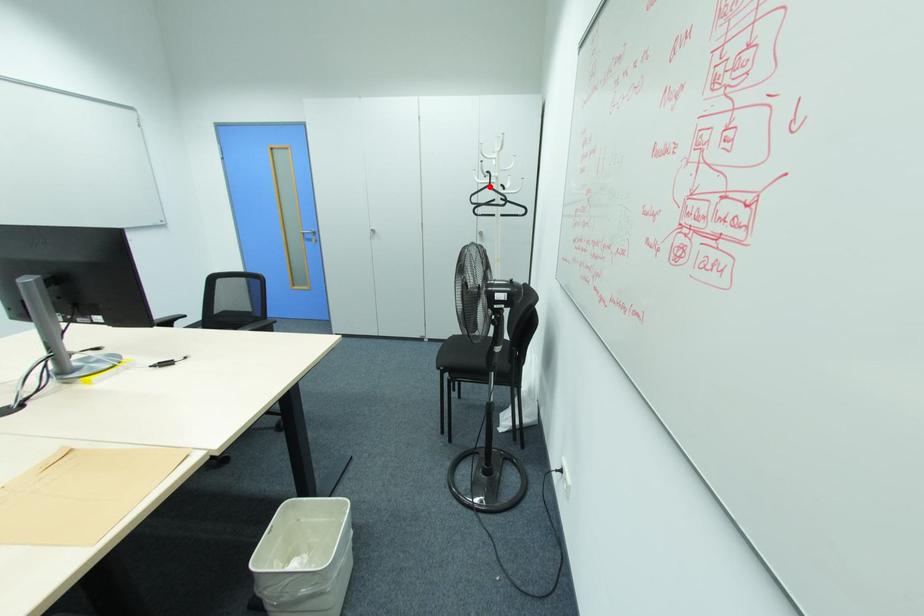
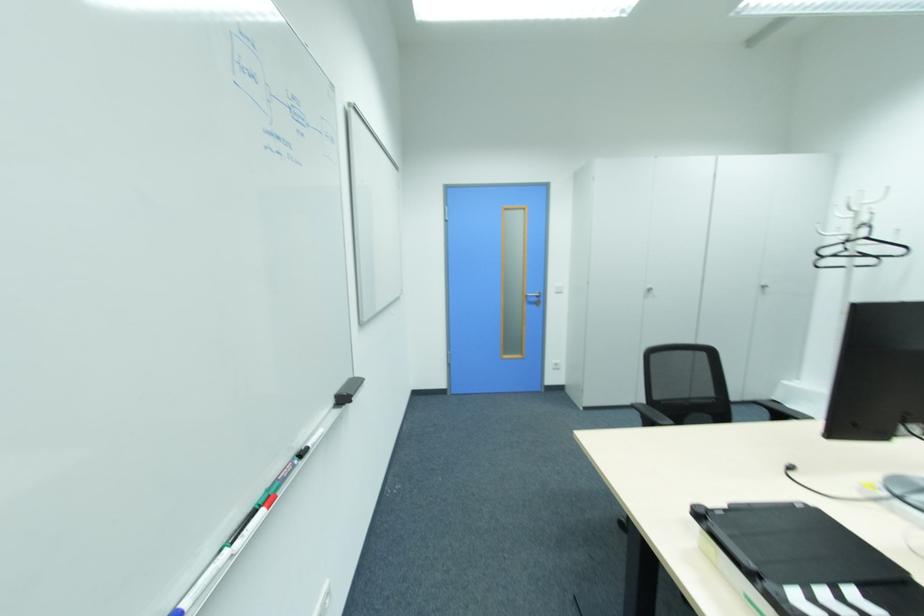
The point at the highlighted location is marked in the first image. Where is the corresponding point in the second image?

(865, 238)